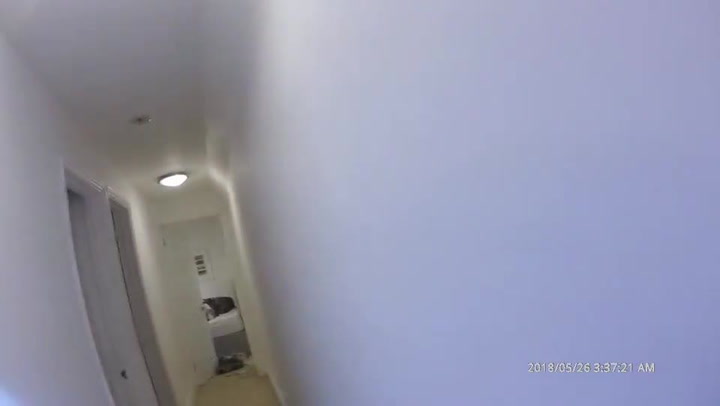
Locate an element on the screen. window is located at coordinates (199, 265).